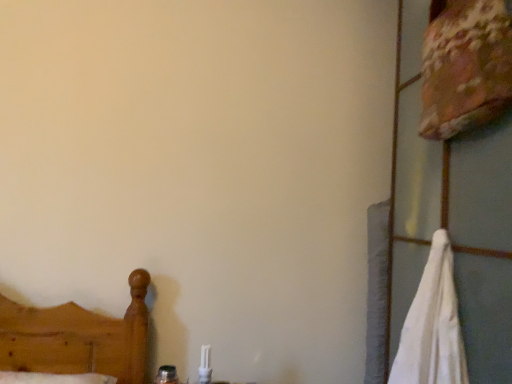
Question: Should I look upward or downward to see white cotton bath towel at right?

Choices:
 (A) up
 (B) down

Answer: (B)

Question: Does white cotton bath towel at right have a greater height compared to floral fabric pillow at upper right?

Choices:
 (A) yes
 (B) no

Answer: (A)

Question: From the image's perspective, does white cotton bath towel at right appear lower than floral fabric pillow at upper right?

Choices:
 (A) yes
 (B) no

Answer: (A)

Question: Considering the relative positions of white cotton bath towel at right and floral fabric pillow at upper right in the image provided, is white cotton bath towel at right to the left of floral fabric pillow at upper right from the viewer's perspective?

Choices:
 (A) no
 (B) yes

Answer: (B)

Question: Is floral fabric pillow at upper right completely or partially inside white cotton bath towel at right?

Choices:
 (A) yes
 (B) no

Answer: (B)

Question: Is the depth of white cotton bath towel at right greater than that of floral fabric pillow at upper right?

Choices:
 (A) no
 (B) yes

Answer: (A)

Question: From a real-world perspective, does white cotton bath towel at right stand above floral fabric pillow at upper right?

Choices:
 (A) yes
 (B) no

Answer: (B)

Question: Is floral fabric pillow at upper right behind white cotton bath towel at right?

Choices:
 (A) yes
 (B) no

Answer: (A)

Question: Does floral fabric pillow at upper right come in front of white cotton bath towel at right?

Choices:
 (A) no
 (B) yes

Answer: (A)

Question: From the image's perspective, does floral fabric pillow at upper right appear lower than white cotton bath towel at right?

Choices:
 (A) no
 (B) yes

Answer: (A)

Question: Is floral fabric pillow at upper right aimed at white cotton bath towel at right?

Choices:
 (A) yes
 (B) no

Answer: (B)

Question: Is floral fabric pillow at upper right outside of white cotton bath towel at right?

Choices:
 (A) no
 (B) yes

Answer: (B)

Question: From a real-world perspective, is floral fabric pillow at upper right physically above white cotton bath towel at right?

Choices:
 (A) yes
 (B) no

Answer: (A)

Question: Is floral fabric pillow at upper right to the left or to the right of white cotton bath towel at right in the image?

Choices:
 (A) right
 (B) left

Answer: (A)